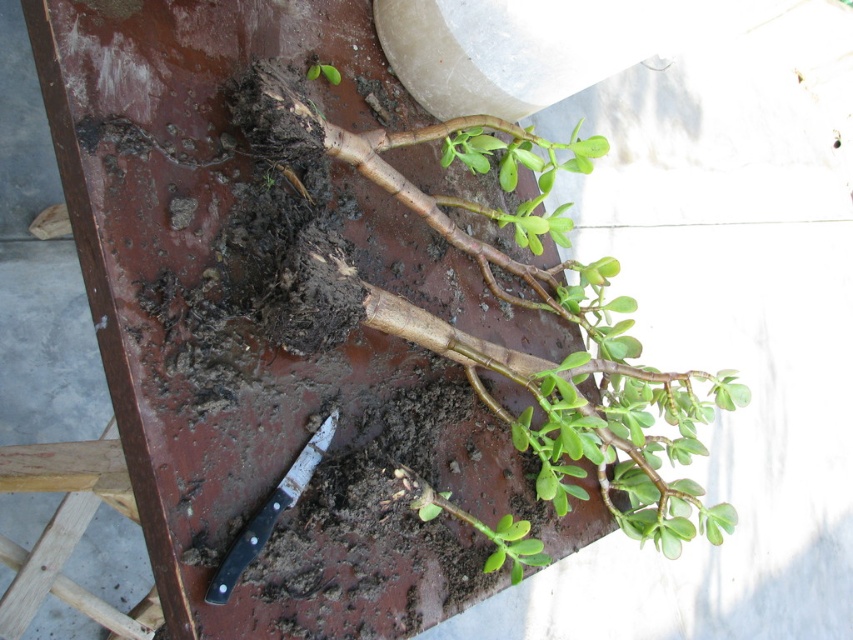
Is dull brown soil at center to the right of black plastic knife at lower left from the viewer's perspective?

Correct, you'll find dull brown soil at center to the right of black plastic knife at lower left.

Between point (144, 449) and point (294, 488), which one is positioned behind?

Point (294, 488)

The image size is (853, 640). In order to click on dull brown soil at center in this screenshot , I will do `click(241, 323)`.

Can you confirm if green matte plant at center is taller than black plastic knife at lower left?

Yes.

Can you confirm if green matte plant at center is shorter than black plastic knife at lower left?

Incorrect, green matte plant at center's height does not fall short of black plastic knife at lower left's.

Who is more distant from viewer, [631,381] or [260,513]?

Positioned behind is point [631,381].

The width and height of the screenshot is (853, 640). What are the coordinates of `green matte plant at center` in the screenshot? It's located at (521, 307).

Who is taller, dull brown soil at center or green matte plant at center?

Standing taller between the two is dull brown soil at center.

Does dull brown soil at center have a lesser height compared to green matte plant at center?

No, dull brown soil at center is not shorter than green matte plant at center.

Is point (136, 72) positioned after point (688, 400)?

No, it is in front of (688, 400).

Find the location of a particular element. The width and height of the screenshot is (853, 640). dull brown soil at center is located at coordinates (241, 323).